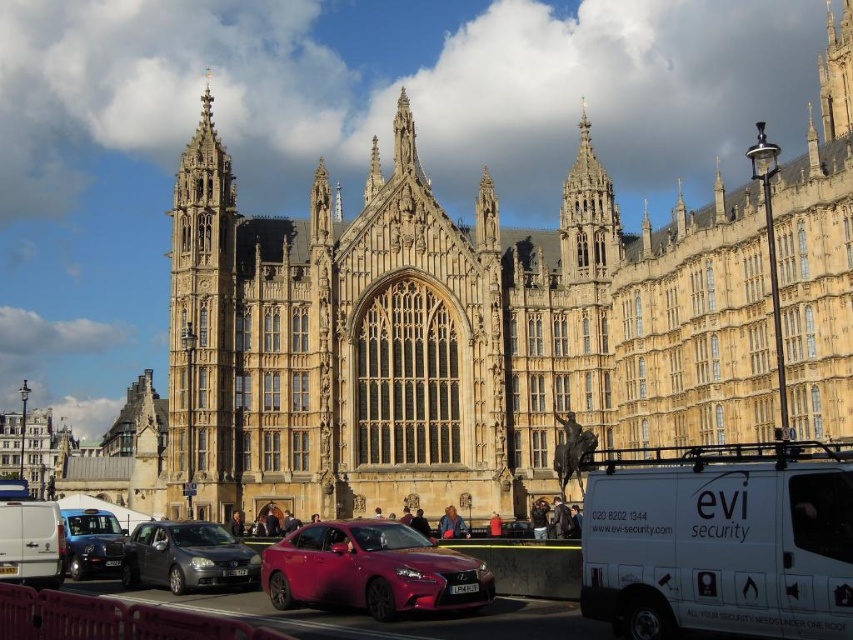
Question: Can you confirm if golden stone palace at center is positioned above white matte van at lower left?

Choices:
 (A) no
 (B) yes

Answer: (B)

Question: Which point appears farthest from the camera in this image?

Choices:
 (A) (711, 461)
 (B) (508, 250)

Answer: (B)

Question: Estimate the real-world distances between objects in this image. Which object is closer to the golden stone palace at center?

Choices:
 (A) white matte van at lower left
 (B) golden stone tower at left

Answer: (B)

Question: Among these objects, which one is nearest to the camera?

Choices:
 (A) golden stone tower at left
 (B) metallic blue taxi at lower left

Answer: (B)

Question: Can you confirm if golden stone palace at center is wider than white matte van at lower left?

Choices:
 (A) yes
 (B) no

Answer: (A)

Question: Does metallic gray sedan at lower left have a lesser width compared to white matte van at lower left?

Choices:
 (A) yes
 (B) no

Answer: (B)